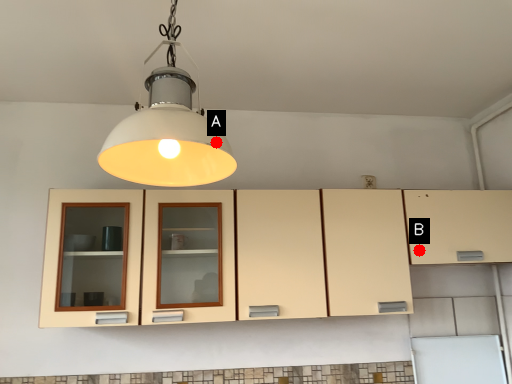
Question: Two points are circled on the image, labeled by A and B beside each circle. Which point is closer to the camera?

Choices:
 (A) A is closer
 (B) B is closer

Answer: (A)